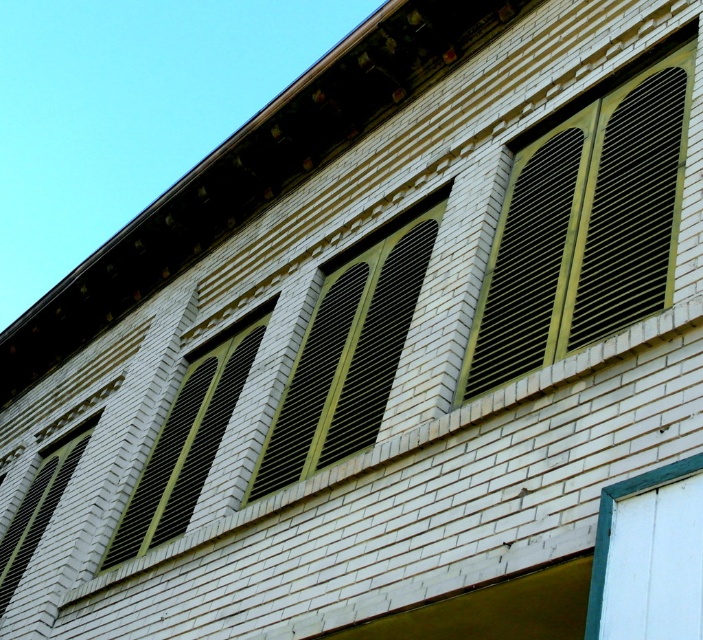
Question: Which of the following is the farthest from the observer?

Choices:
 (A) matte black shutter at center
 (B) matte black window at lower left
 (C) green matte shutters at upper right

Answer: (B)

Question: Is green matte shutters at center wider than matte black shutter at center?

Choices:
 (A) no
 (B) yes

Answer: (B)

Question: Which point appears closest to the camera in this image?

Choices:
 (A) (489, 266)
 (B) (120, 540)
 (C) (299, 396)

Answer: (A)

Question: Does green matte shutters at center have a smaller size compared to matte black window at lower left?

Choices:
 (A) yes
 (B) no

Answer: (B)

Question: Is green matte shutters at center positioned before matte black window at lower left?

Choices:
 (A) yes
 (B) no

Answer: (A)

Question: Among these objects, which one is farthest from the camera?

Choices:
 (A) green matte shutters at center
 (B) green matte shutters at upper right
 (C) matte black window at lower left

Answer: (C)